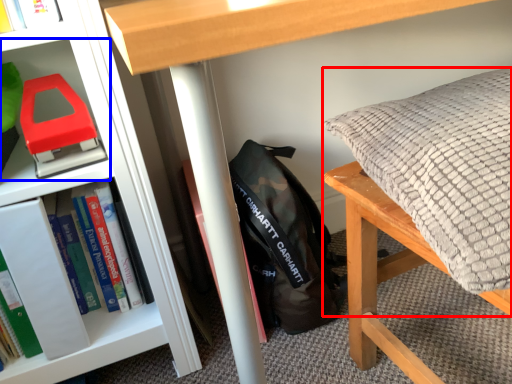
Question: Which of the following is the farthest to the observer, pillow (highlighted by a red box) or shelf (highlighted by a blue box)?

Choices:
 (A) pillow
 (B) shelf

Answer: (B)